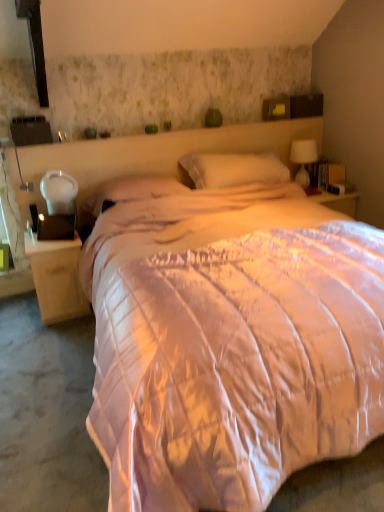
Question: Based on their positions, is white soft pillow at center, which appears as the first pillow when viewed from the right, located to the left or right of white matte nightstand at left?

Choices:
 (A) right
 (B) left

Answer: (A)

Question: In terms of size, does white soft pillow at center, which appears as the first pillow when viewed from the right, appear bigger or smaller than white matte nightstand at left?

Choices:
 (A) big
 (B) small

Answer: (A)

Question: Which is nearer to the matte pink pillow at center, which is the 2th pillow in right-to-left order?

Choices:
 (A) white soft pillow at center, placed as the 2th pillow when sorted from left to right
 (B) white matte nightstand at left
 (C) white glass table lamp at upper right

Answer: (A)

Question: Which of these objects is positioned closest to the white matte nightstand at left?

Choices:
 (A) white soft pillow at center, which appears as the first pillow when viewed from the right
 (B) white glass table lamp at upper right
 (C) matte pink pillow at center, which is the first pillow from left to right

Answer: (C)